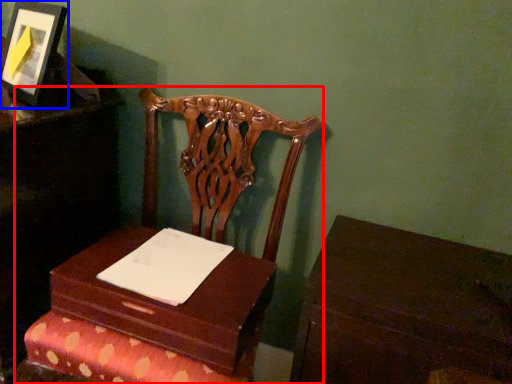
Question: Which point is further to the camera, furniture (highlighted by a red box) or picture frame (highlighted by a blue box)?

Choices:
 (A) furniture
 (B) picture frame

Answer: (B)